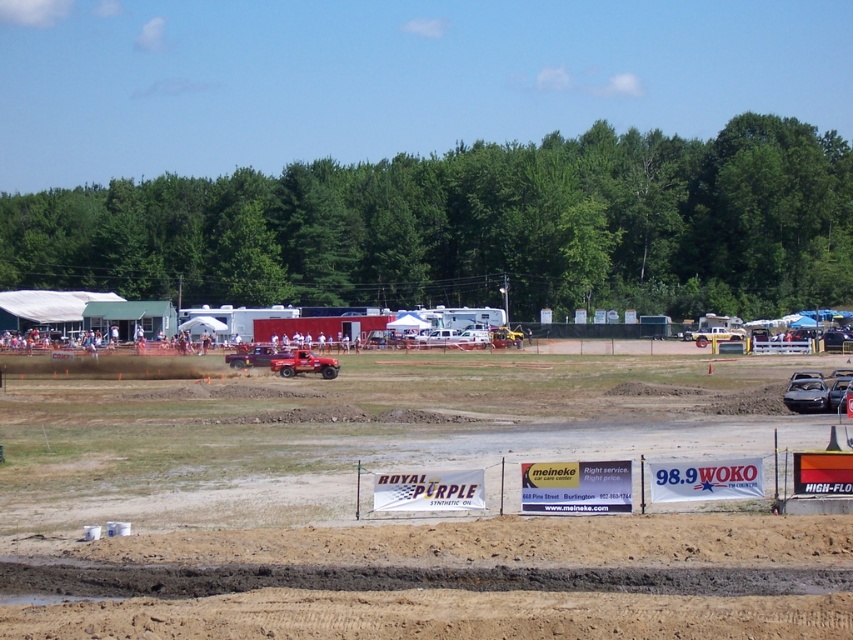
You are a photographer at the motorsport event and want to capture both the point at coordinates (283, 360) and the point at coordinates (257, 364) in your photo. Which point should you focus on first to ensure both are in focus?

You should focus on point (283, 360) first because it is closer to the camera than point (257, 364). By focusing on the closer point, the farther point will also be within the depth of field, ensuring both are in focus.

You are a spectator at the motorsport event and want to take a photo of both the shiny red truck at center and the matte red truck at center. Which truck should you position yourself to the left of to capture both in the frame?

You should position yourself to the left of the matte red truck at center. Since the shiny red truck at center is to the right of the matte red truck at center, this positioning would allow both trucks to be in your camera frame.